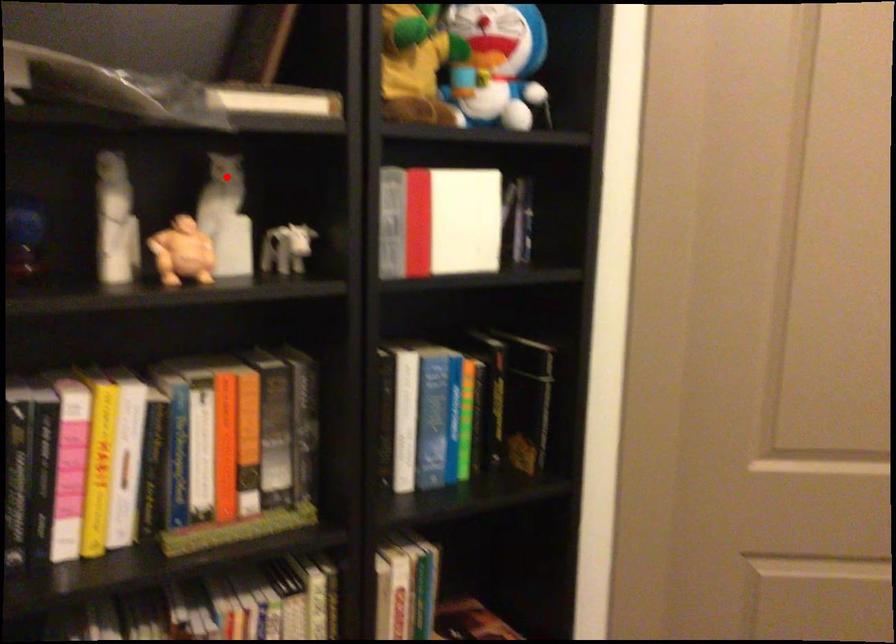
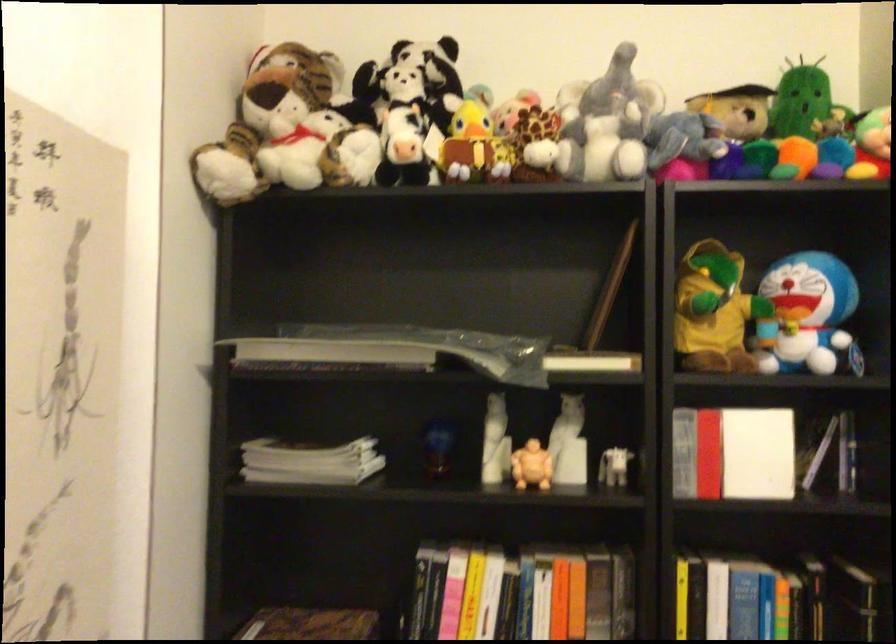
Where in the second image is the point corresponding to the highlighted location from the first image?

(572, 409)